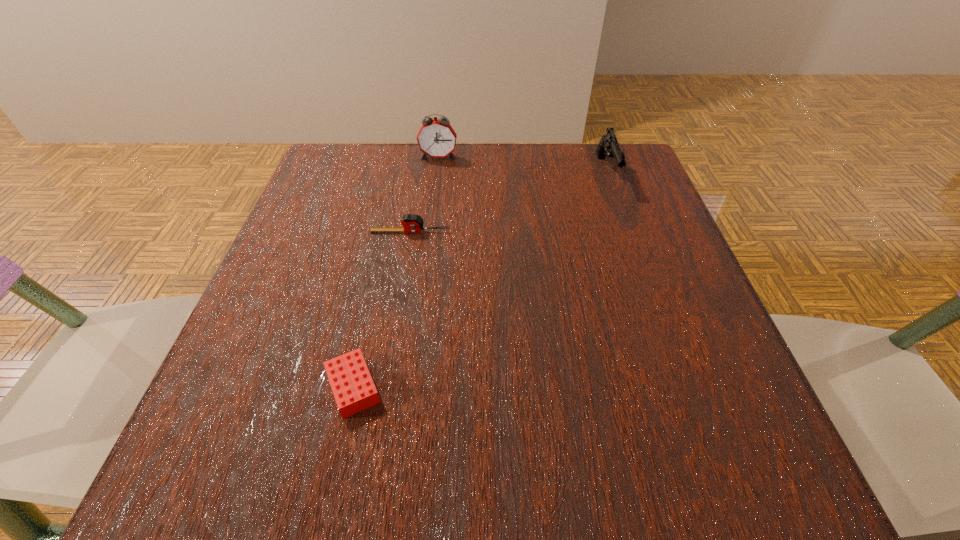
This screenshot has height=540, width=960. I want to click on vacant area situated 0.180m on the right of the Lego, so click(x=508, y=387).

Where is `alarm clock that is at the far edge`? Image resolution: width=960 pixels, height=540 pixels. alarm clock that is at the far edge is located at coordinates (436, 138).

Find the location of a particular element. The height and width of the screenshot is (540, 960). gun situated at the far edge is located at coordinates (608, 146).

Locate an element on the screen. object present at the left edge is located at coordinates (352, 385).

Find the location of a particular element. Image resolution: width=960 pixels, height=540 pixels. object that is at the right edge is located at coordinates (608, 146).

The width and height of the screenshot is (960, 540). I want to click on object that is at the far right corner, so click(x=608, y=146).

In the image, there is a desktop. Identify the location of vacant space at the far edge. (446, 170).

This screenshot has height=540, width=960. Find the location of `free space at the near edge of the desktop`. free space at the near edge of the desktop is located at coordinates (529, 446).

Find the location of a particular element. free spot at the left edge of the desktop is located at coordinates (293, 288).

The width and height of the screenshot is (960, 540). I want to click on vacant space at the right edge of the desktop, so [x=606, y=215].